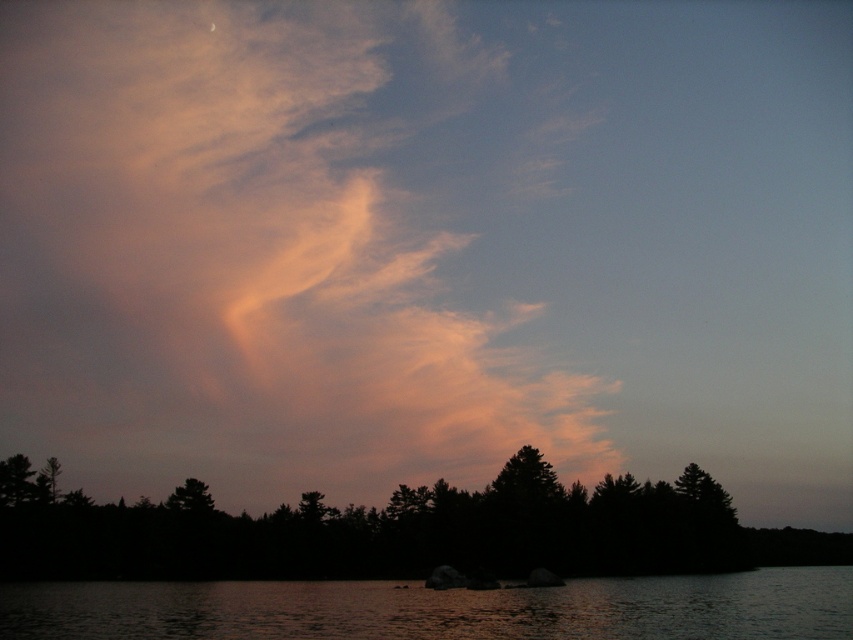
You are an observer looking at the scene. There is a translucent pink cloud at upper center and a dark water at lower center. Which object is positioned to the left of the other?

The translucent pink cloud at upper center is to the left of dark water at lower center.